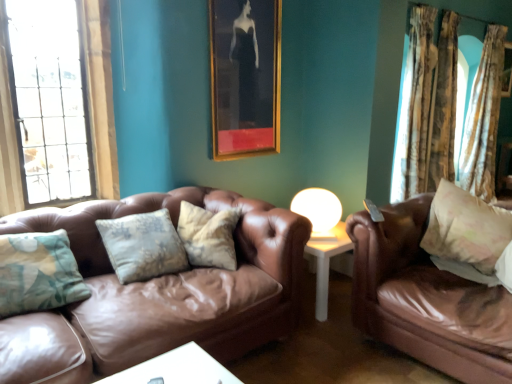
This screenshot has width=512, height=384. What do you see at coordinates (245, 77) in the screenshot? I see `gold-framed picture at upper center, which is the second picture frame in right-to-left order` at bounding box center [245, 77].

Measure the distance between white glossy table lamp at center and camera.

The depth of white glossy table lamp at center is 2.43 meters.

This screenshot has width=512, height=384. What do you see at coordinates (100, 95) in the screenshot?
I see `clear glass window at left` at bounding box center [100, 95].

Where is `brown leather couch at right, the 2th studio couch in the left-to-right sequence`? The width and height of the screenshot is (512, 384). brown leather couch at right, the 2th studio couch in the left-to-right sequence is located at coordinates (426, 299).

You are a GUI agent. You are given a task and a screenshot of the screen. Output one action in this format:
    pyautogui.click(x=<x>, y=<y>)
    Task: Click on the fluffy beige pillow at right
    This screenshot has height=384, width=512.
    Given the screenshot: What is the action you would take?
    pyautogui.click(x=466, y=228)

Would you say wooden picture frame at upper right, which appears as the second picture frame when viewed from the front, is part of fluffy beige pillow at right's contents?

No, wooden picture frame at upper right, which appears as the second picture frame when viewed from the front, is not surrounded by fluffy beige pillow at right.

Which is more to the left, fluffy beige pillow at right or wooden picture frame at upper right, the second picture frame from the left?

From the viewer's perspective, fluffy beige pillow at right appears more on the left side.

Is fluffy beige pillow at right facing away from wooden picture frame at upper right, arranged as the first picture frame when viewed from the back?

Yes, wooden picture frame at upper right, arranged as the first picture frame when viewed from the back, is at the back of fluffy beige pillow at right.

Who is smaller, fluffy beige pillow at right or wooden picture frame at upper right, the second picture frame from the left?

With smaller size is wooden picture frame at upper right, the second picture frame from the left.

Between textured beige curtain at right, which appears as the third curtain when viewed from the right, and floral fabric curtain at right, which ranks as the 2th curtain in left-to-right order, which one is positioned behind?

floral fabric curtain at right, which ranks as the 2th curtain in left-to-right order, is behind.

The height and width of the screenshot is (384, 512). I want to click on curtain that is the 1st one below the textured beige curtain at right, which appears as the third curtain when viewed from the right (from a real-world perspective), so click(425, 103).

Is textured beige curtain at right, marked as the first curtain in a left-to-right arrangement, taller or shorter than floral fabric curtain at right, which is counted as the second curtain, starting from the right?

textured beige curtain at right, marked as the first curtain in a left-to-right arrangement, is shorter than floral fabric curtain at right, which is counted as the second curtain, starting from the right.

From a real-world perspective, who is located lower, textured beige curtain at right, which appears as the third curtain when viewed from the right, or floral fabric curtain at right, which is counted as the second curtain, starting from the right?

floral fabric curtain at right, which is counted as the second curtain, starting from the right.

Considering the positions of objects textured beige curtain at right, which is the 3th curtain in left-to-right order, and clear glass window at left in the image provided, who is more to the left, textured beige curtain at right, which is the 3th curtain in left-to-right order, or clear glass window at left?

clear glass window at left.

What's the angular difference between textured beige curtain at right, which is the 3th curtain in left-to-right order, and clear glass window at left's facing directions?

The angular difference between textured beige curtain at right, which is the 3th curtain in left-to-right order, and clear glass window at left is 0.0845 degrees.

Looking at this image, from the image's perspective, which one is positioned higher, textured beige curtain at right, acting as the 1th curtain starting from the right, or clear glass window at left?

textured beige curtain at right, acting as the 1th curtain starting from the right, is shown above in the image.

Would you say textured beige curtain at right, acting as the 1th curtain starting from the right, contains clear glass window at left?

Actually, clear glass window at left is outside textured beige curtain at right, acting as the 1th curtain starting from the right.

Is brown leather couch at left, the first studio couch viewed from the left, not inside brown leather couch at right, which is the first studio couch in right-to-left order?

That's correct, brown leather couch at left, the first studio couch viewed from the left, is outside of brown leather couch at right, which is the first studio couch in right-to-left order.

Which of these two, brown leather couch at left, acting as the 2th studio couch starting from the right, or brown leather couch at right, the 2th studio couch in the left-to-right sequence, is wider?

brown leather couch at right, the 2th studio couch in the left-to-right sequence.

From their relative heights in the image, would you say brown leather couch at left, the first studio couch viewed from the left, is taller or shorter than brown leather couch at right, which is the first studio couch in right-to-left order?

In the image, brown leather couch at left, the first studio couch viewed from the left, appears to be taller than brown leather couch at right, which is the first studio couch in right-to-left order.

Is brown leather couch at left, acting as the 2th studio couch starting from the right, not close to brown leather couch at right, which is the first studio couch in right-to-left order?

They are positioned close to each other.

Is textured beige curtain at right, which is the 3th curtain in left-to-right order, located within clear glass window at left?

No, textured beige curtain at right, which is the 3th curtain in left-to-right order, is not surrounded by clear glass window at left.

Who is more distant, clear glass window at left or textured beige curtain at right, which is the 3th curtain in left-to-right order?

textured beige curtain at right, which is the 3th curtain in left-to-right order, is more distant.

From the clear glass window at left, count 3rd curtain to the right and point to it. Please provide its 2D coordinates.

[(483, 119)]

You are a GUI agent. You are given a task and a screenshot of the screen. Output one action in this format:
    pyautogui.click(x=<x>, y=<y>)
    Task: Click on the curtain located underneath the floral fabric curtain at right, which ranks as the 2th curtain in left-to-right order (from a real-world perspective)
    This screenshot has height=384, width=512.
    Given the screenshot: What is the action you would take?
    pyautogui.click(x=483, y=119)

Can floral fabric curtain at right, which is counted as the second curtain, starting from the right, be found inside textured beige curtain at right, acting as the 1th curtain starting from the right?

No, floral fabric curtain at right, which is counted as the second curtain, starting from the right, is not inside textured beige curtain at right, acting as the 1th curtain starting from the right.

Considering the sizes of objects textured beige curtain at right, which is the 3th curtain in left-to-right order, and floral fabric curtain at right, which is counted as the second curtain, starting from the right, in the image provided, who is wider, textured beige curtain at right, which is the 3th curtain in left-to-right order, or floral fabric curtain at right, which is counted as the second curtain, starting from the right,?

textured beige curtain at right, which is the 3th curtain in left-to-right order.

What's the angular difference between textured beige curtain at right, acting as the 1th curtain starting from the right, and floral fabric curtain at right, which is counted as the second curtain, starting from the right,'s facing directions?

textured beige curtain at right, acting as the 1th curtain starting from the right, and floral fabric curtain at right, which is counted as the second curtain, starting from the right, are facing 0.00414 degrees away from each other.

From a real-world perspective, which object rests below the other?

brown leather couch at right, which is the first studio couch in right-to-left order, is physically lower.

From the image's perspective, is brown leather couch at right, the 2th studio couch in the left-to-right sequence, below floral fabric curtain at right, which is counted as the second curtain, starting from the right?

Yes, from the image's perspective, brown leather couch at right, the 2th studio couch in the left-to-right sequence, is beneath floral fabric curtain at right, which is counted as the second curtain, starting from the right.

Is brown leather couch at right, which is the first studio couch in right-to-left order, facing towards floral fabric curtain at right, which is counted as the second curtain, starting from the right?

No, brown leather couch at right, which is the first studio couch in right-to-left order, does not turn towards floral fabric curtain at right, which is counted as the second curtain, starting from the right.

Between brown leather couch at right, which is the first studio couch in right-to-left order, and floral fabric curtain at right, which is counted as the second curtain, starting from the right, which one has less height?

With less height is brown leather couch at right, which is the first studio couch in right-to-left order.

Where is `pillow in front of the wooden picture frame at upper right, the second picture frame from the left`? The width and height of the screenshot is (512, 384). pillow in front of the wooden picture frame at upper right, the second picture frame from the left is located at coordinates (466, 228).

From a real-world perspective, count 1st curtains downward from the textured beige curtain at right, marked as the first curtain in a left-to-right arrangement, and point to it. Please provide its 2D coordinates.

[(425, 103)]

When comparing their distances from fluffy beige pillow at right, does white glossy table lamp at center or brown leather couch at right, which is the first studio couch in right-to-left order, seem further?

Based on the image, white glossy table lamp at center appears to be further to fluffy beige pillow at right.

Which object lies further to the anchor point textured beige curtain at right, marked as the first curtain in a left-to-right arrangement, gold-framed picture at upper center, which is counted as the second picture frame, starting from the back, or wooden picture frame at upper right, which is counted as the 1th picture frame, starting from the right?

gold-framed picture at upper center, which is counted as the second picture frame, starting from the back, is further to textured beige curtain at right, marked as the first curtain in a left-to-right arrangement.

Looking at the image, which one is located further to clear glass window at left, textured beige curtain at right, acting as the 1th curtain starting from the right, or textured beige curtain at right, marked as the first curtain in a left-to-right arrangement?

textured beige curtain at right, acting as the 1th curtain starting from the right, is further to clear glass window at left.

When comparing their distances from gold-framed picture at upper center, which is the 1th picture frame from front to back, does white glossy table lamp at center or brown leather couch at left, acting as the 2th studio couch starting from the right, seem closer?

white glossy table lamp at center is positioned closer to the anchor gold-framed picture at upper center, which is the 1th picture frame from front to back.

Looking at the image, which one is located closer to brown leather couch at left, acting as the 2th studio couch starting from the right, gold-framed picture at upper center, which is counted as the second picture frame, starting from the back, or textured beige curtain at right, which is the 3th curtain in left-to-right order?

The object closer to brown leather couch at left, acting as the 2th studio couch starting from the right, is gold-framed picture at upper center, which is counted as the second picture frame, starting from the back.

Based on their spatial positions, is white glossy table lamp at center or fluffy beige pillow at right further from clear glass window at left?

fluffy beige pillow at right is positioned further to the anchor clear glass window at left.

When comparing their distances from white glossy table lamp at center, does floral fabric curtain at right, which ranks as the 2th curtain in left-to-right order, or clear glass window at left seem closer?

Based on the image, clear glass window at left appears to be nearer to white glossy table lamp at center.

Which object lies nearer to the anchor point clear glass window at left, textured beige curtain at right, which appears as the third curtain when viewed from the right, or brown leather couch at right, which is the first studio couch in right-to-left order?

brown leather couch at right, which is the first studio couch in right-to-left order.

You are a GUI agent. You are given a task and a screenshot of the screen. Output one action in this format:
    pyautogui.click(x=<x>, y=<y>)
    Task: Click on the curtain between textured beige curtain at right, which appears as the third curtain when viewed from the right, and textured beige curtain at right, acting as the 1th curtain starting from the right, in the horizontal direction
    This screenshot has height=384, width=512.
    Given the screenshot: What is the action you would take?
    pyautogui.click(x=425, y=103)

I want to click on pillow positioned between brown leather couch at right, which is the first studio couch in right-to-left order, and textured beige curtain at right, which appears as the third curtain when viewed from the right, from near to far, so click(x=466, y=228).

You are a GUI agent. You are given a task and a screenshot of the screen. Output one action in this format:
    pyautogui.click(x=<x>, y=<y>)
    Task: Click on the table lamp between gold-framed picture at upper center, which is the 1th picture frame from front to back, and fluffy beige pillow at right
    This screenshot has width=512, height=384.
    Given the screenshot: What is the action you would take?
    pyautogui.click(x=318, y=211)

The image size is (512, 384). In order to click on table lamp situated between clear glass window at left and textured beige curtain at right, which appears as the third curtain when viewed from the right, from left to right in this screenshot , I will do `click(318, 211)`.